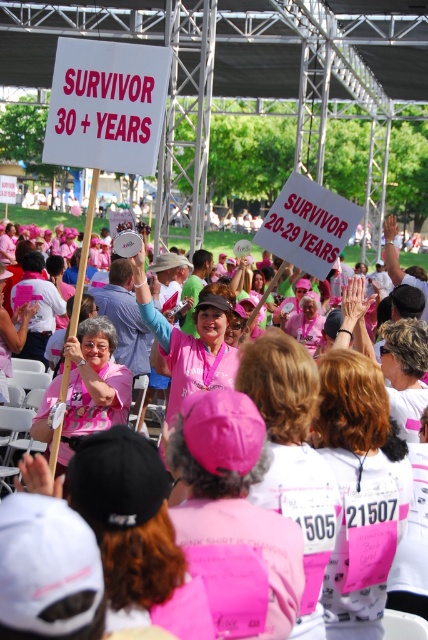
Who is lower down, white matte shirt at center or pink satin scarf at center?

Positioned lower is white matte shirt at center.

Who is positioned more to the left, white matte shirt at center or pink satin scarf at center?

Positioned to the left is white matte shirt at center.

Is point (348, 396) behind point (318, 316)?

That is False.

Where is `white matte shirt at center`? This screenshot has height=640, width=428. white matte shirt at center is located at coordinates (360, 492).

Between pink fabric shirt at center and pink fabric sign at center, which one is positioned higher?

pink fabric sign at center

Between pink fabric shirt at center and pink fabric sign at center, which one appears on the left side from the viewer's perspective?

Positioned to the left is pink fabric sign at center.

Is point (291, 390) positioned before point (115, 397)?

Yes, it is in front of point (115, 397).

The width and height of the screenshot is (428, 640). Find the location of `pink fabric shirt at center`. pink fabric shirt at center is located at coordinates (293, 458).

How distant is white matte shirt at center from pink fabric shirt at center?

Result: white matte shirt at center and pink fabric shirt at center are 28.63 centimeters apart from each other.

Measure the distance between white matte shirt at center and camera.

3.08 meters

Which is behind, point (362, 432) or point (297, 435)?

The point (362, 432) is behind.

Identify the location of white matte shirt at center. (360, 492).